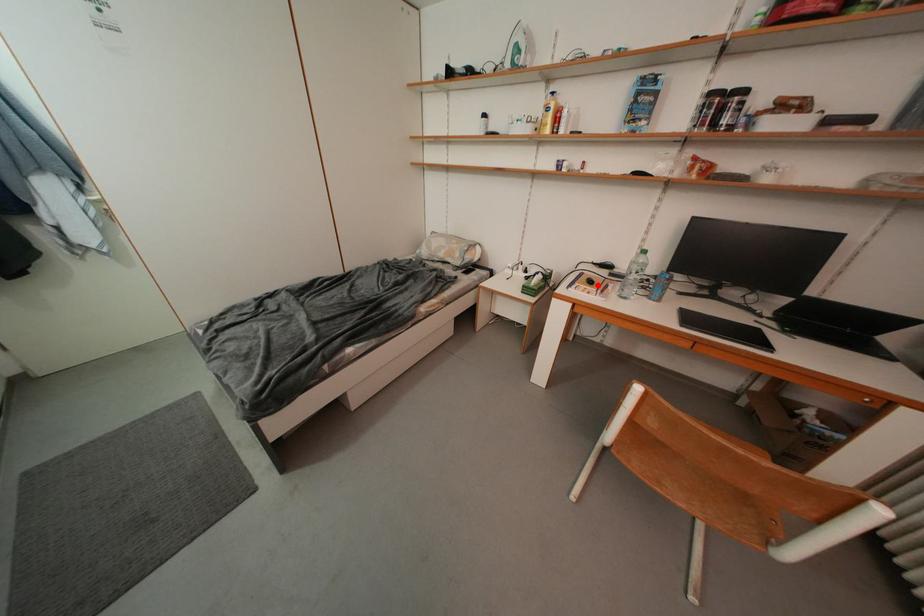
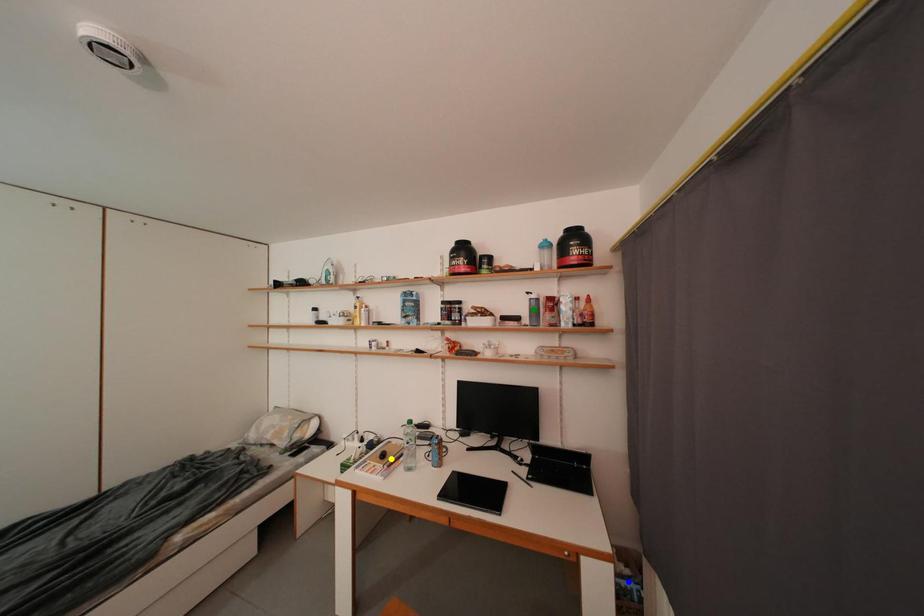
Question: I am providing you with two images of the same scene from different viewpoints. A red point is marked on the first image. You are given multiple points on the second image. Which mark in image 2 goes with the point in image 1?

Choices:
 (A) yellow point
 (B) green point
 (C) blue point

Answer: (A)